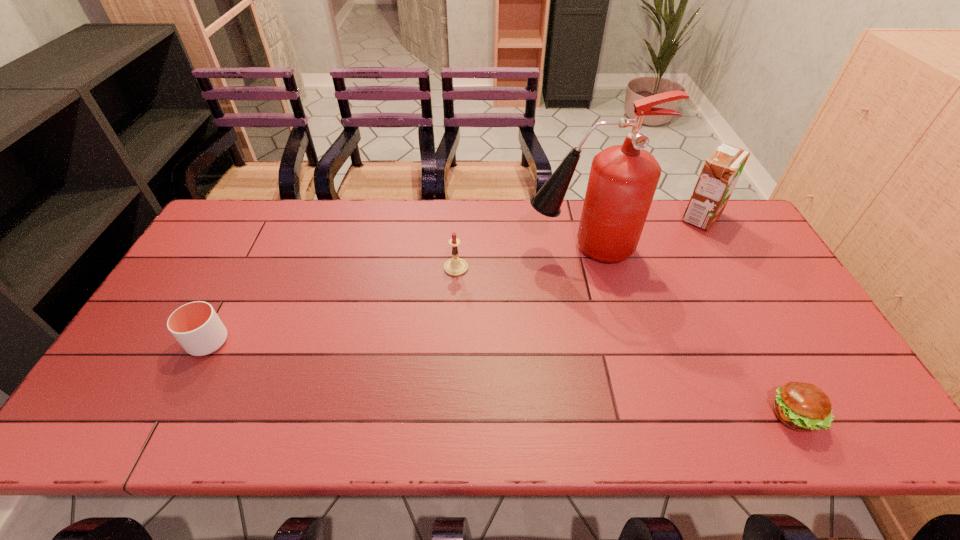
Identify the location of object located in the near edge section of the desktop. (800, 406).

In order to click on object at the left edge in this screenshot , I will do `click(196, 326)`.

Where is `carton present at the right edge`? The image size is (960, 540). carton present at the right edge is located at coordinates (722, 169).

This screenshot has height=540, width=960. I want to click on hamburger that is positioned at the right edge, so click(x=800, y=406).

Locate an element on the screen. object present at the far right corner is located at coordinates (722, 169).

The width and height of the screenshot is (960, 540). I want to click on object that is at the near right corner, so click(x=800, y=406).

Locate an element on the screen. The height and width of the screenshot is (540, 960). vacant region at the far edge of the desktop is located at coordinates (493, 206).

You are a GUI agent. You are given a task and a screenshot of the screen. Output one action in this format:
    pyautogui.click(x=<x>, y=<y>)
    Task: Click on the free point at the near edge
    
    Given the screenshot: What is the action you would take?
    pyautogui.click(x=212, y=434)

You are a GUI agent. You are given a task and a screenshot of the screen. Output one action in this format:
    pyautogui.click(x=<x>, y=<y>)
    Task: Click on the free space at the left edge
    This screenshot has width=960, height=540.
    Given the screenshot: What is the action you would take?
    pyautogui.click(x=187, y=301)

The image size is (960, 540). In the image, there is a desktop. Identify the location of blank space at the right edge. (753, 280).